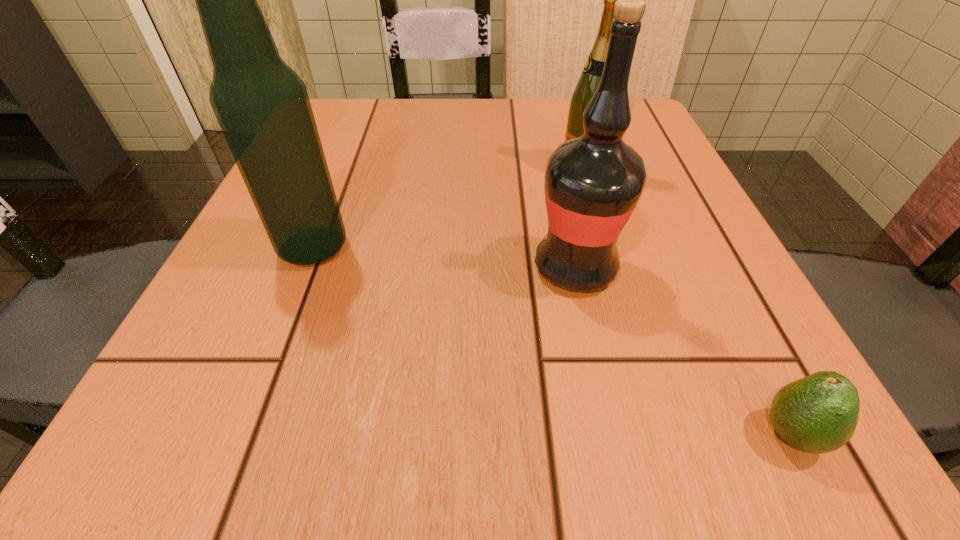
Find the location of a particular element. vacant space located on the front-facing side of the farthest object is located at coordinates (362, 168).

Find the location of a particular element. vacant region located on the left of the nearest object is located at coordinates (495, 434).

Find the location of `object that is at the near edge`. object that is at the near edge is located at coordinates (817, 414).

This screenshot has height=540, width=960. I want to click on object at the left edge, so point(262,106).

This screenshot has height=540, width=960. Identify the location of wine bottle positioned at the right edge. (589, 80).

You are a GUI agent. You are given a task and a screenshot of the screen. Output one action in this format:
    pyautogui.click(x=<x>, y=<y>)
    Task: Click on the avocado that is positioned at the right edge
    
    Given the screenshot: What is the action you would take?
    pyautogui.click(x=817, y=414)

Identify the location of object located in the near right corner section of the desktop. Image resolution: width=960 pixels, height=540 pixels. (817, 414).

This screenshot has width=960, height=540. In the image, there is a desktop. Find the location of `free space at the far edge`. free space at the far edge is located at coordinates (399, 130).

In the image, there is a desktop. At what (x,y) coordinates should I click in order to perform the action: click on vacant space at the near edge. Please return your answer as a coordinate pair (x, y). The height and width of the screenshot is (540, 960). Looking at the image, I should click on (521, 411).

Where is `free point at the left edge`? This screenshot has height=540, width=960. free point at the left edge is located at coordinates pyautogui.click(x=354, y=208).